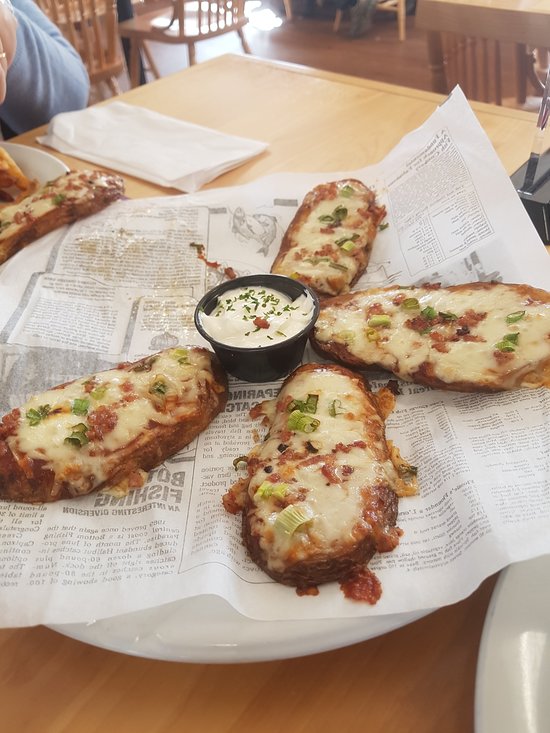
Find the location of a particular element. The image size is (550, 733). the lower edge of white plate is located at coordinates (222, 638).